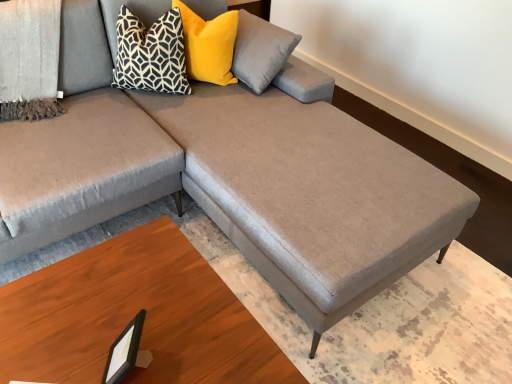
Question: From the image's perspective, is wooden table at lower right above black plastic picture frame at lower left?

Choices:
 (A) yes
 (B) no

Answer: (B)

Question: Does wooden table at lower right have a greater width compared to black plastic picture frame at lower left?

Choices:
 (A) yes
 (B) no

Answer: (A)

Question: Are wooden table at lower right and black plastic picture frame at lower left far apart?

Choices:
 (A) yes
 (B) no

Answer: (B)

Question: Is wooden table at lower right turned away from black plastic picture frame at lower left?

Choices:
 (A) no
 (B) yes

Answer: (A)

Question: From a real-world perspective, does wooden table at lower right sit lower than black plastic picture frame at lower left?

Choices:
 (A) yes
 (B) no

Answer: (A)

Question: From the image's perspective, is textured gray blanket at upper left located above or below wooden table at lower right?

Choices:
 (A) below
 (B) above

Answer: (B)

Question: From a real-world perspective, is textured gray blanket at upper left physically located above or below wooden table at lower right?

Choices:
 (A) above
 (B) below

Answer: (A)

Question: Is textured gray blanket at upper left taller or shorter than wooden table at lower right?

Choices:
 (A) tall
 (B) short

Answer: (A)

Question: Is textured gray blanket at upper left inside or outside of wooden table at lower right?

Choices:
 (A) inside
 (B) outside

Answer: (B)

Question: From a real-world perspective, relative to textured gray blanket at upper left, is yellow velvet pillow at upper center, acting as the 2th pillow starting from the left, vertically above or below?

Choices:
 (A) below
 (B) above

Answer: (A)

Question: From the image's perspective, is yellow velvet pillow at upper center, acting as the first pillow starting from the right, positioned above or below textured gray blanket at upper left?

Choices:
 (A) below
 (B) above

Answer: (B)

Question: Considering the positions of point (222, 39) and point (2, 61), is point (222, 39) closer or farther from the camera than point (2, 61)?

Choices:
 (A) closer
 (B) farther

Answer: (B)

Question: Based on their positions, is yellow velvet pillow at upper center, acting as the 2th pillow starting from the left, located to the left or right of textured gray blanket at upper left?

Choices:
 (A) right
 (B) left

Answer: (A)

Question: Considering the positions of black plastic picture frame at lower left and black geometric-patterned pillow at upper left, the 1th pillow in the left-to-right sequence, in the image, is black plastic picture frame at lower left wider or thinner than black geometric-patterned pillow at upper left, the 1th pillow in the left-to-right sequence,?

Choices:
 (A) wide
 (B) thin

Answer: (B)

Question: Is black plastic picture frame at lower left taller or shorter than black geometric-patterned pillow at upper left, arranged as the 2th pillow when viewed from the right?

Choices:
 (A) short
 (B) tall

Answer: (A)